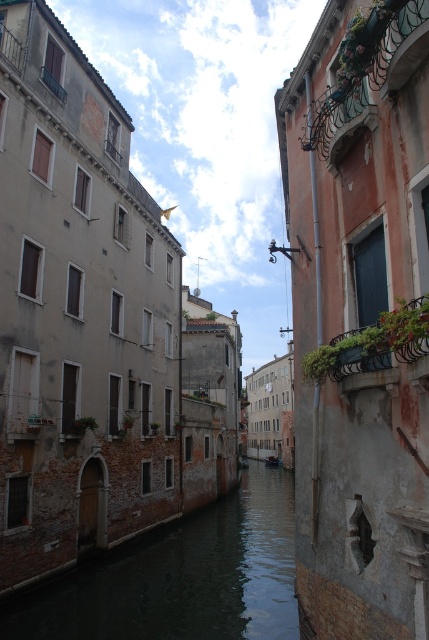
Question: Can you confirm if dark water at center is positioned above wooden boat at center?

Choices:
 (A) yes
 (B) no

Answer: (A)

Question: Considering the relative positions of dark water at center and wooden boat at center in the image provided, where is dark water at center located with respect to wooden boat at center?

Choices:
 (A) right
 (B) left

Answer: (B)

Question: Does dark water at center have a smaller size compared to wooden boat at center?

Choices:
 (A) no
 (B) yes

Answer: (A)

Question: Which point is farther from the camera taking this photo?

Choices:
 (A) (275, 460)
 (B) (278, 531)

Answer: (A)

Question: Which of the following is the farthest from the observer?

Choices:
 (A) (165, 536)
 (B) (266, 458)

Answer: (B)